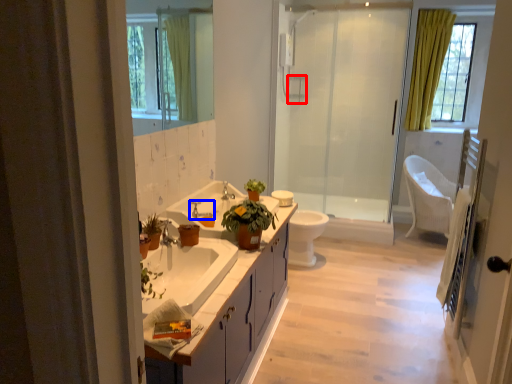
Question: Which object appears farthest to the camera in this image, towel bar (highlighted by a red box) or tap (highlighted by a blue box)?

Choices:
 (A) towel bar
 (B) tap

Answer: (A)